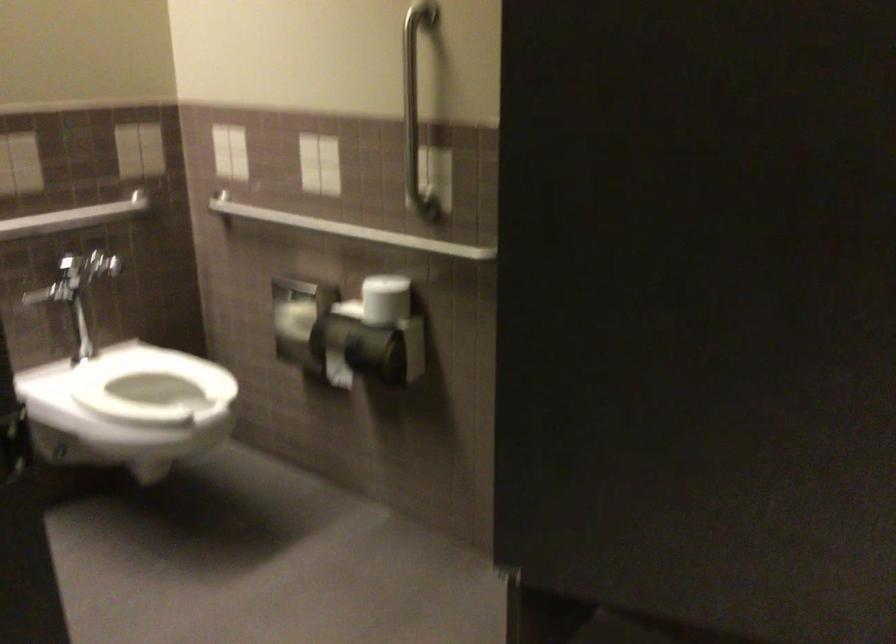
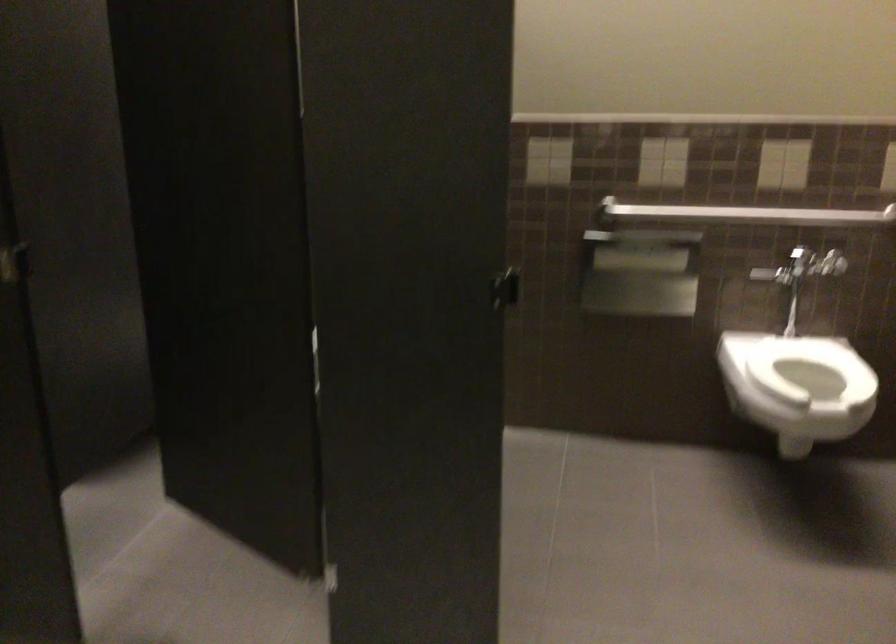
Question: The camera is either moving clockwise (left) or counter-clockwise (right) around the object. The first image is from the beginning of the video and the second image is from the end. Is the camera moving left or right when shooting the video?

Choices:
 (A) Left
 (B) Right

Answer: (B)